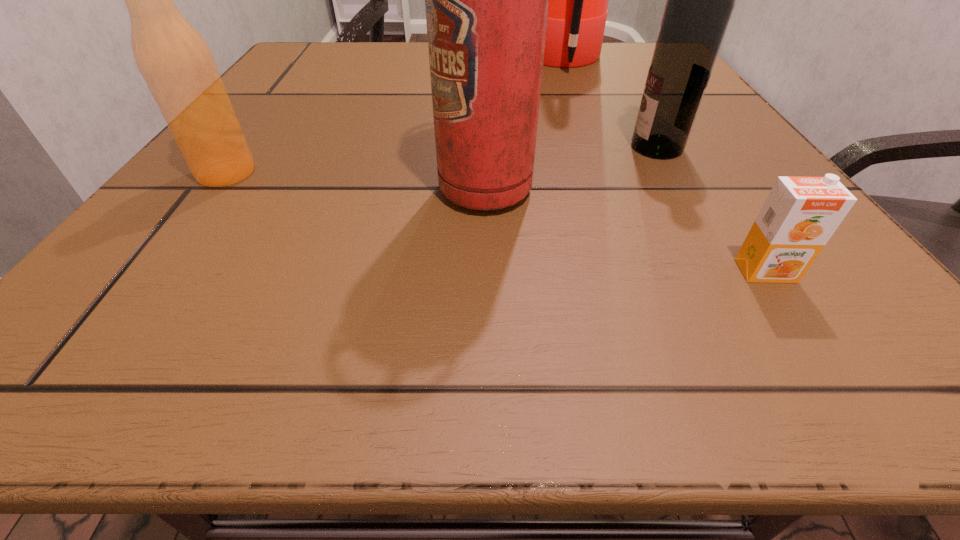
At what (x,y) coordinates should I click in order to perform the action: click on vacant space positioned 0.190m towards the nozzle of the taller fire extinguisher. Please return your answer as a coordinate pair (x, y). This screenshot has width=960, height=540. Looking at the image, I should click on (437, 62).

The height and width of the screenshot is (540, 960). In order to click on free space located 0.340m towards the nozzle of the taller fire extinguisher in this screenshot , I will do `click(368, 62)`.

Find the location of a particular element. The width and height of the screenshot is (960, 540). vacant space located 0.240m on the label side of the shorter fire extinguisher is located at coordinates (266, 190).

Locate an element on the screen. vacant region located on the label side of the shorter fire extinguisher is located at coordinates (396, 190).

At what (x,y) coordinates should I click in order to perform the action: click on blank area located on the label side of the shorter fire extinguisher. Please return your answer as a coordinate pair (x, y). This screenshot has width=960, height=540. Looking at the image, I should click on (274, 190).

Locate an element on the screen. vacant space positioned 0.280m on the front and back of the alcohol is located at coordinates (453, 147).

I want to click on vacant space located on the front and back of the alcohol, so click(x=593, y=147).

Identify the location of free region located on the front and back of the alcohol. (536, 147).

Find the location of a particular element. The image size is (960, 540). free space located on the back of the second shortest object is located at coordinates (254, 136).

Where is `free space located on the front of the shortest object`? This screenshot has height=540, width=960. free space located on the front of the shortest object is located at coordinates (802, 327).